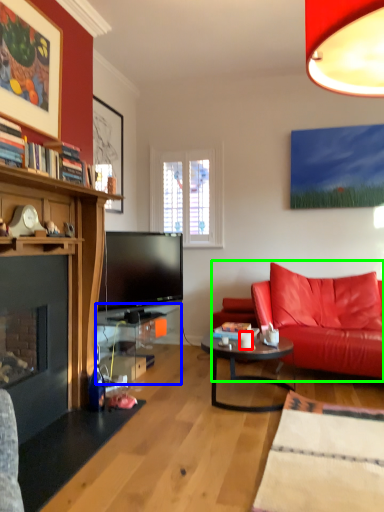
Question: Considering the real-world distances, which object is farthest from coffee cup (highlighted by a red box)? table (highlighted by a blue box) or studio couch (highlighted by a green box)?

Choices:
 (A) table
 (B) studio couch

Answer: (A)